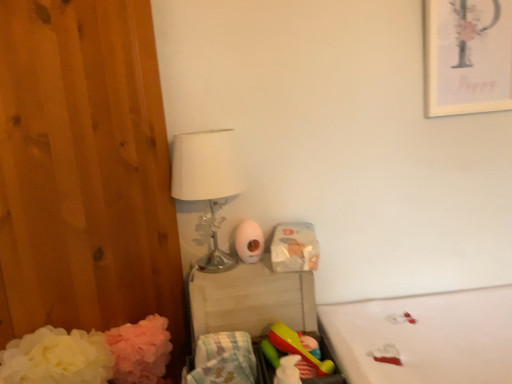
Image resolution: width=512 pixels, height=384 pixels. What are the coordinates of `vacant space underneath white glossy table lamp at upper left (from a real-world perspective)` in the screenshot? It's located at (218, 268).